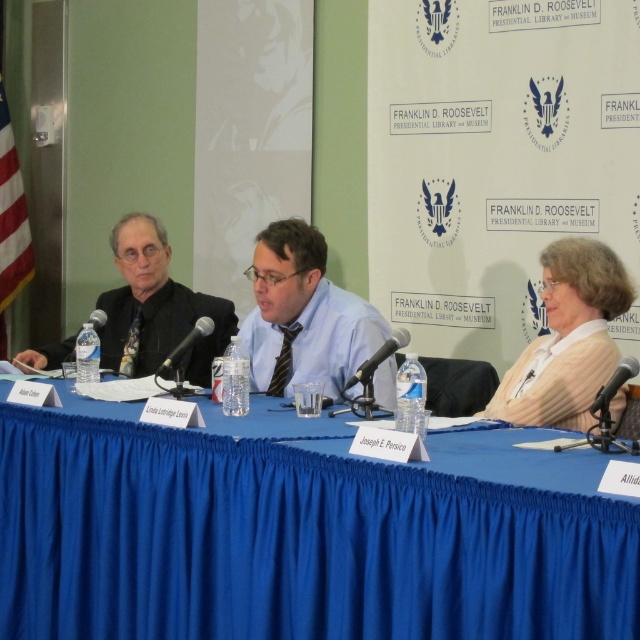
Question: Which object is farther from the camera taking this photo?

Choices:
 (A) black matte microphone at center
 (B) blue fabric table at center

Answer: (A)

Question: Does blue fabric table at center appear under blue shirt at center?

Choices:
 (A) yes
 (B) no

Answer: (A)

Question: Which point appears farthest from the camera in this image?

Choices:
 (A) (140, 582)
 (B) (362, 376)
 (C) (586, 292)
 (D) (595, 401)

Answer: (C)

Question: Considering the relative positions of black metallic microphone at center and black metallic microphone at right in the image provided, where is black metallic microphone at center located with respect to black metallic microphone at right?

Choices:
 (A) right
 (B) left

Answer: (B)

Question: Considering the real-world distances, which object is closest to the matte black suit at left?

Choices:
 (A) clear plastic microphone at left
 (B) black metallic microphone at center
 (C) white sweater at right
 (D) black matte microphone at center

Answer: (A)

Question: In this image, where is black matte microphone at center located relative to clear plastic microphone at left?

Choices:
 (A) left
 (B) right

Answer: (B)